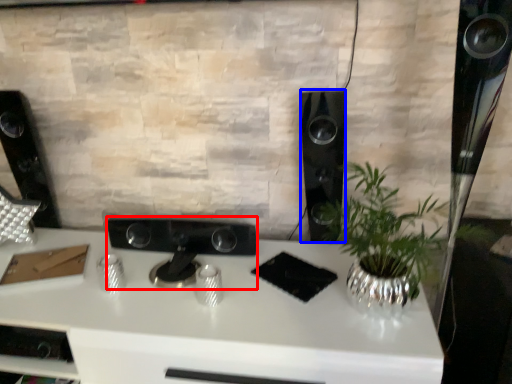
Question: Which object is closer to the camera taking this photo, appliance (highlighted by a red box) or speaker (highlighted by a blue box)?

Choices:
 (A) appliance
 (B) speaker

Answer: (B)